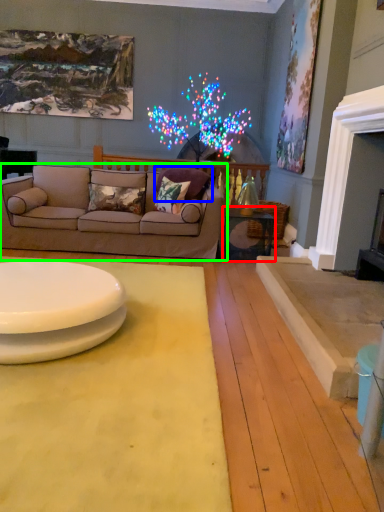
Question: Which object is the farthest from table (highlighted by a red box)? Choose among these: pillow (highlighted by a blue box) or studio couch (highlighted by a green box).

Choices:
 (A) pillow
 (B) studio couch

Answer: (B)